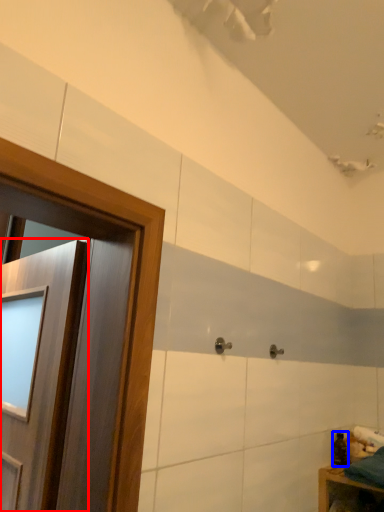
Question: Which point is closer to the camera, door (highlighted by a red box) or toiletry (highlighted by a blue box)?

Choices:
 (A) door
 (B) toiletry

Answer: (A)